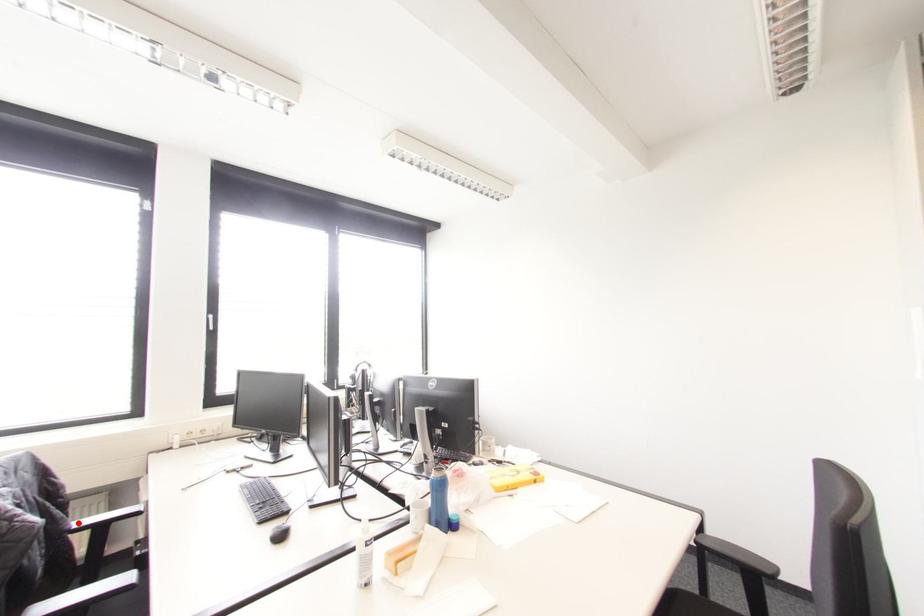
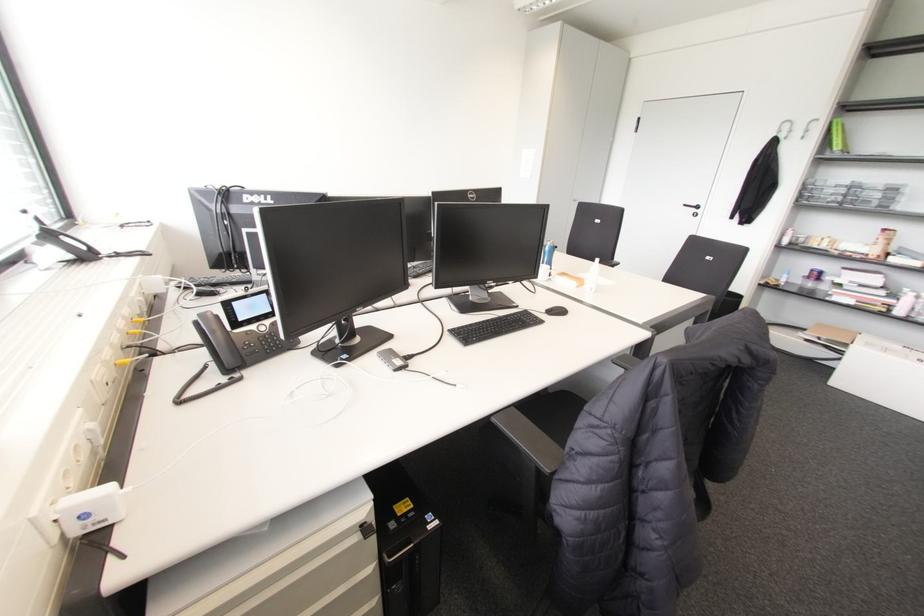
Question: I am providing you with two images of the same scene from different viewpoints. A red point is marked on the first image. At the location where the point appears in image 1, is it still visible in image 2?

Choices:
 (A) Yes
 (B) No

Answer: (B)